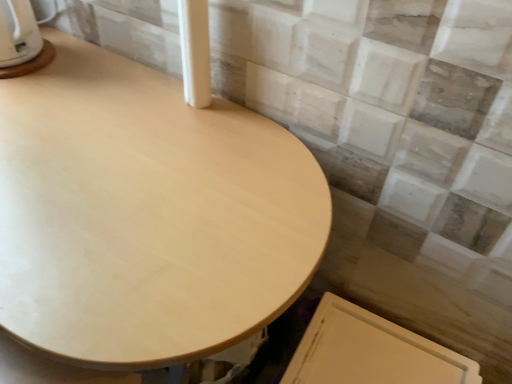
Image resolution: width=512 pixels, height=384 pixels. I want to click on free area in between white glossy kettle at upper left and white smooth pillar at upper center, so click(103, 75).